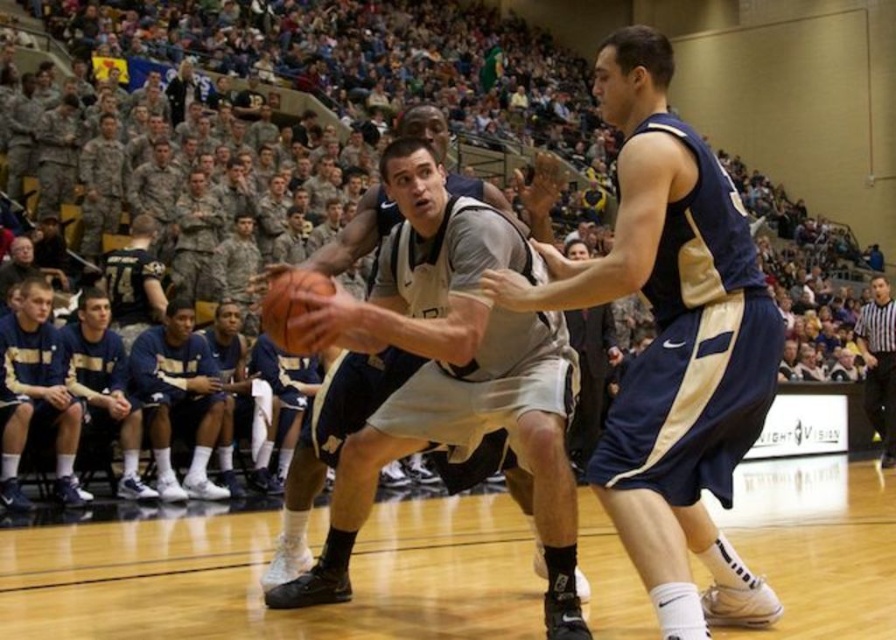
Question: Can you confirm if wooden floor at center is smaller than dark blue jersey at lower left?

Choices:
 (A) no
 (B) yes

Answer: (A)

Question: Which point is farther to the camera?

Choices:
 (A) (220, 406)
 (B) (550, 522)
 (C) (869, 401)
 (D) (636, 557)

Answer: (C)

Question: Can you confirm if navy blue jersey at center is positioned to the left of matte gray jersey at center?

Choices:
 (A) no
 (B) yes

Answer: (A)

Question: Which object is farther from the camera taking this photo?

Choices:
 (A) black and white striped shirt at right
 (B) navy blue jersey at right
 (C) navy blue jersey at center

Answer: (A)

Question: Which point is closer to the camera?

Choices:
 (A) black and white striped shirt at right
 (B) dark blue jersey at lower left

Answer: (B)

Question: Does navy blue jersey at right have a larger size compared to rubber textured basketball at center?

Choices:
 (A) yes
 (B) no

Answer: (A)